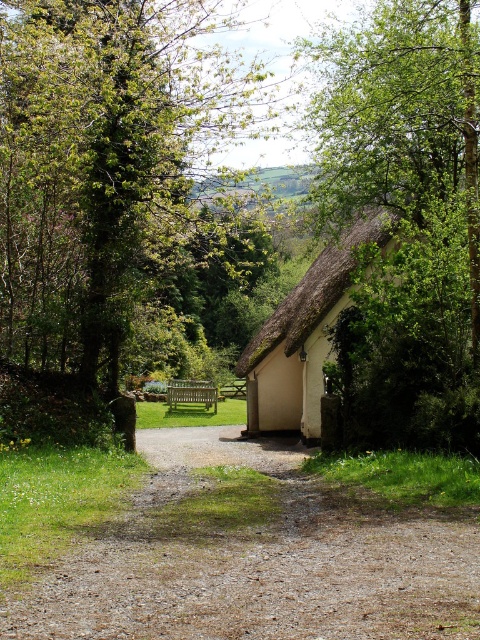
You are standing at the entrance of the cottage and want to sit down to rest. Which object from the gravel at center and the green leafy tree at upper right is closer to you?

The gravel at center is closer to the viewer than the green leafy tree at upper right, so the gravel at center is closer to you.

You are standing at the entrance of the cottage and want to walk to the wooden bench. The entrance is located at point (x=301, y=356), and the bench is at point (x=229, y=394). Which direction should you walk to reach the bench?

Point (x=301, y=356) is in front of point (x=229, y=394). Therefore, to reach the bench at point (x=229, y=394) from the entrance at point (x=301, y=356), you should walk backward or in the opposite direction since the bench is behind the entrance.

You are planning to walk along the gravel at center towards the cottage. There is a green leafy tree at upper right nearby. Which one is wider in width?

The gravel at center has a lesser width compared to the green leafy tree at upper right, so the green leafy tree at upper right is wider in width.